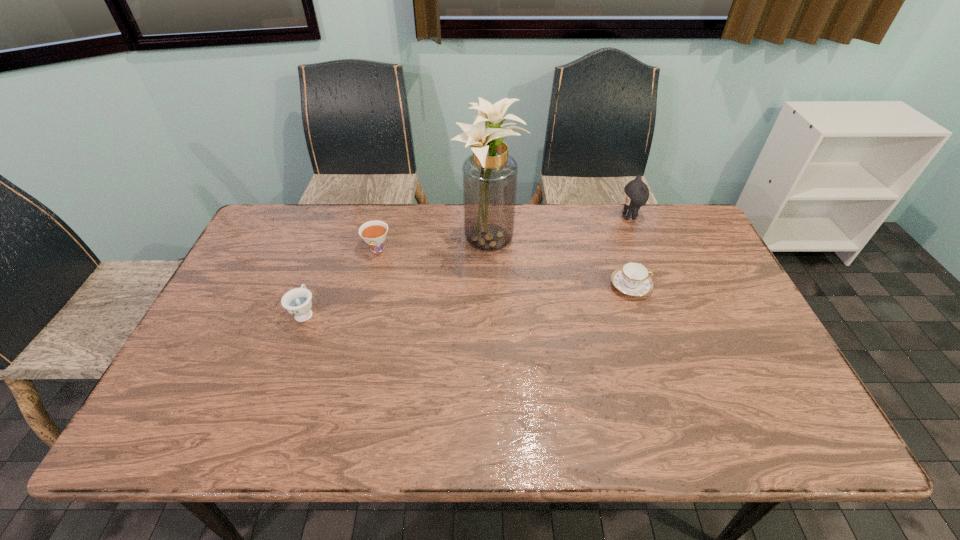
Where is `blank area located 0.310m on the front-facing side of the second tallest object`? blank area located 0.310m on the front-facing side of the second tallest object is located at coordinates (527, 217).

The image size is (960, 540). What are the coordinates of `free region located 0.340m on the front-facing side of the second tallest object` in the screenshot? It's located at (518, 217).

Where is `vacant space located 0.220m on the side of the second teacup from left to right with the handle`? vacant space located 0.220m on the side of the second teacup from left to right with the handle is located at coordinates (361, 315).

Locate an element on the screen. The height and width of the screenshot is (540, 960). free location located on the side of the leftmost teacup with the handle is located at coordinates (335, 229).

This screenshot has width=960, height=540. I want to click on vacant position located on the side of the leftmost teacup with the handle, so click(324, 260).

The image size is (960, 540). Find the location of `vacant space positioned on the side of the leftmost teacup with the handle`. vacant space positioned on the side of the leftmost teacup with the handle is located at coordinates (318, 278).

Identify the location of free space located 0.220m on the side with the handle of the rightmost teacup. (727, 286).

This screenshot has height=540, width=960. I want to click on flower arrangement that is at the far edge, so click(x=490, y=175).

Locate an element on the screen. kitten positioned at the far edge is located at coordinates (636, 193).

The height and width of the screenshot is (540, 960). I want to click on teacup that is positioned at the far edge, so click(x=374, y=233).